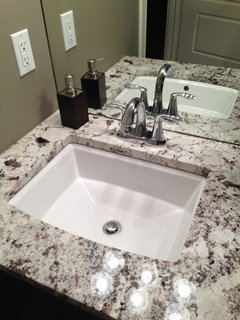
Image resolution: width=240 pixels, height=320 pixels. What are the coordinates of `outlet` in the screenshot? It's located at (25, 69).